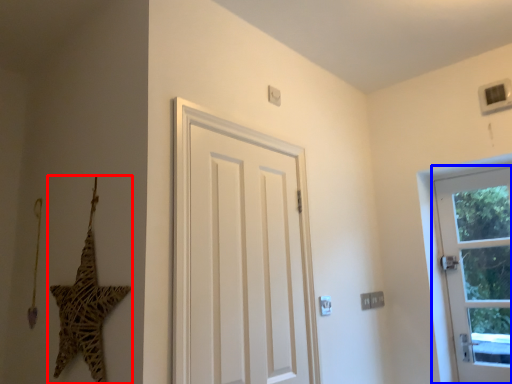
Question: Which point is further to the camera, star (highlighted by a red box) or door (highlighted by a blue box)?

Choices:
 (A) star
 (B) door

Answer: (B)